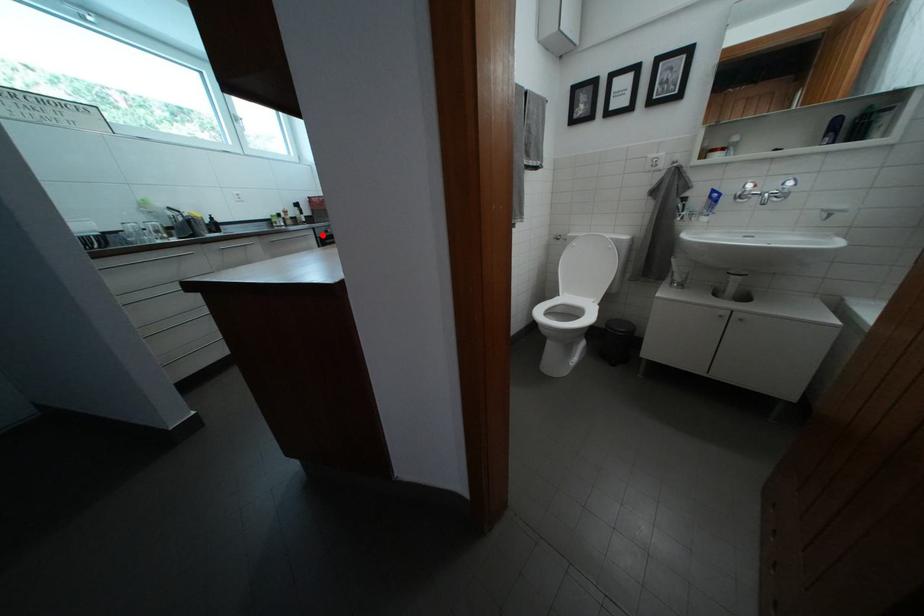
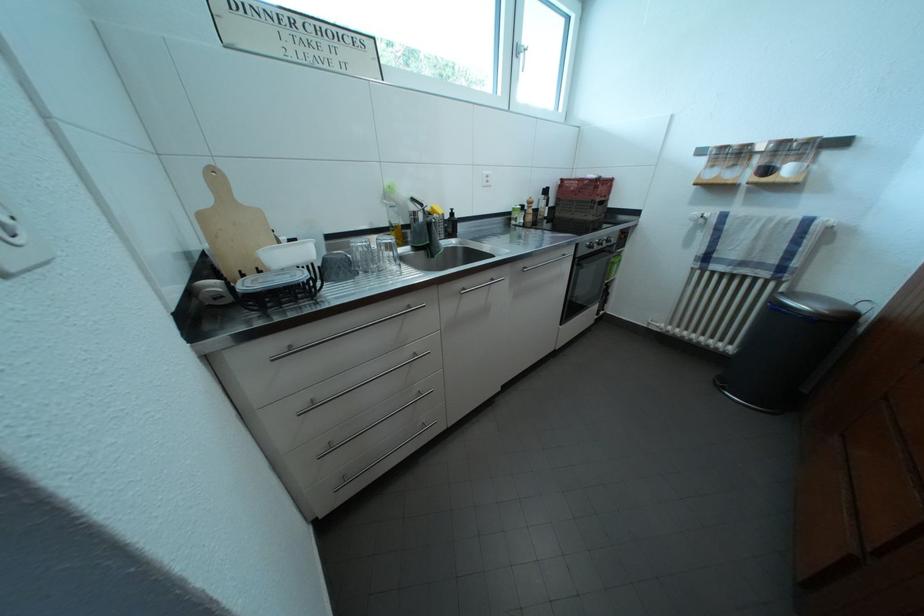
Find the pixel in the second image that matches the highlighted location in the first image.

(587, 251)